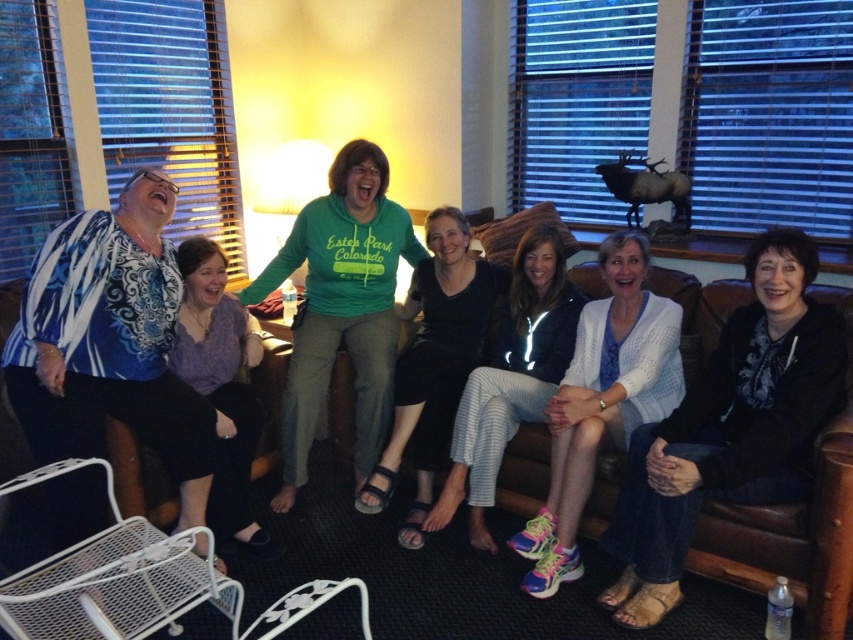
Question: Which point appears closest to the camera in this image?

Choices:
 (A) (624, 403)
 (B) (808, 364)

Answer: (B)

Question: Where is white knit cardigan at center located in relation to white striped pants at center in the image?

Choices:
 (A) left
 (B) right

Answer: (B)

Question: Which point is farther to the camera?

Choices:
 (A) black cotton pants at center
 (B) white striped pants at center
 (C) white knit sweater at center

Answer: (A)

Question: Can you confirm if black cotton pants at center is positioned to the left of white striped pants at center?

Choices:
 (A) yes
 (B) no

Answer: (A)

Question: Which point is closer to the camera?

Choices:
 (A) (514, 413)
 (B) (209, 320)
 (C) (624, 280)

Answer: (C)

Question: Can you confirm if white striped pants at center is bigger than matte blue blouse at left?

Choices:
 (A) yes
 (B) no

Answer: (A)